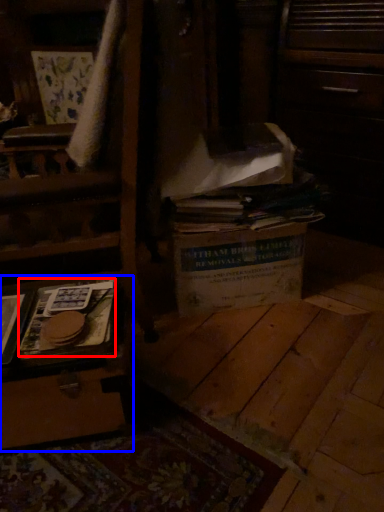
Question: Which of the following is the closest to the observer, paperback book (highlighted by a red box) or vanity (highlighted by a blue box)?

Choices:
 (A) paperback book
 (B) vanity

Answer: (B)